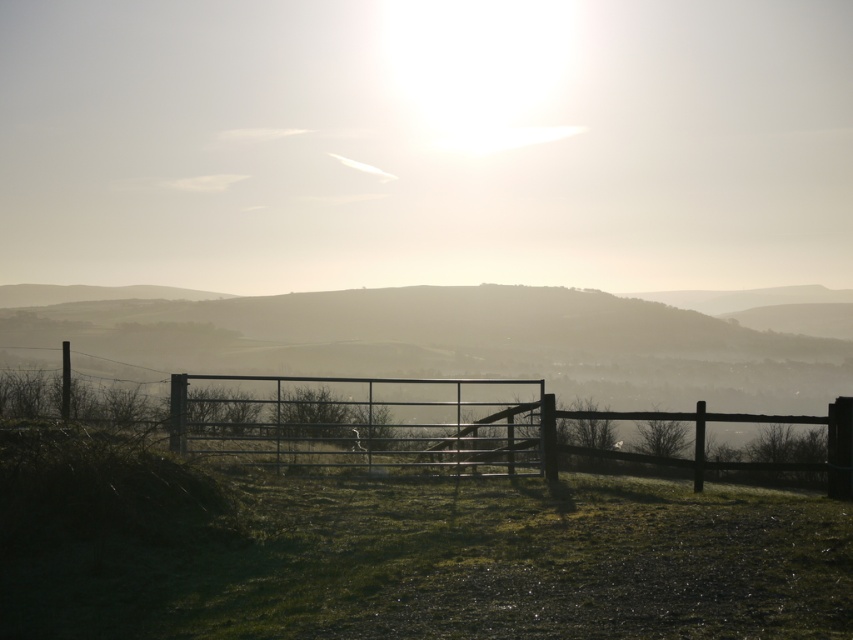
You are standing in the middle of the green grassy at center and want to walk towards the metallic gate at center. In which direction should you head?

You should head to the left because the green grassy at center is to the right of the metallic gate at center, so moving left will take you towards the gate.

You are a landscape photographer who wants to capture the entire scene in one shot. Given that the green grassy at center and metallic gate at center are both in the frame, which object takes up more area in the photo?

The metallic gate at center occupies more space than the green grassy at center in the photo.